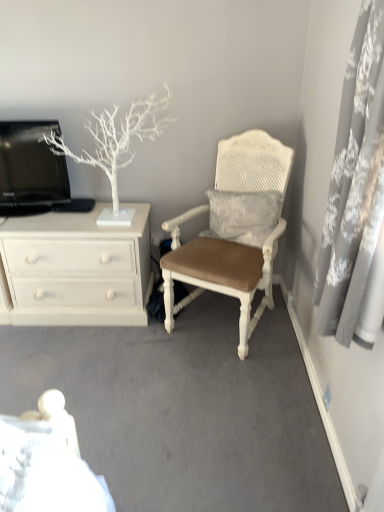
The image size is (384, 512). I want to click on free location in front of white textured cushioned chair at center, so click(x=220, y=386).